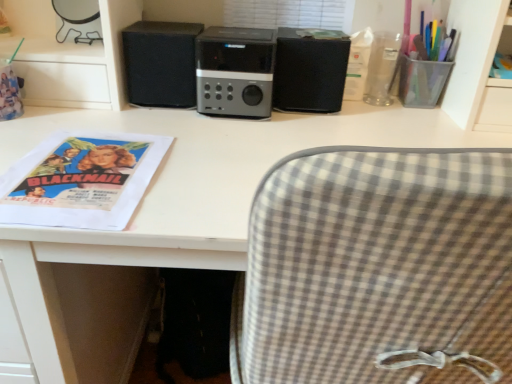
The width and height of the screenshot is (512, 384). Find the location of `free space above matte paper poster at left (from a real-world perspective)`. free space above matte paper poster at left (from a real-world perspective) is located at coordinates (84, 146).